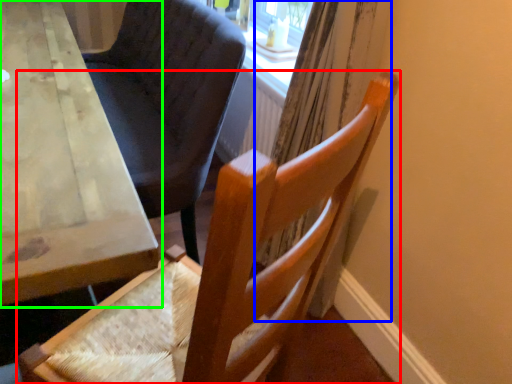
Question: Estimate the real-world distances between objects in this image. Which object is farther from chair (highlighted by a red box), curtain (highlighted by a blue box) or table (highlighted by a green box)?

Choices:
 (A) curtain
 (B) table

Answer: (A)